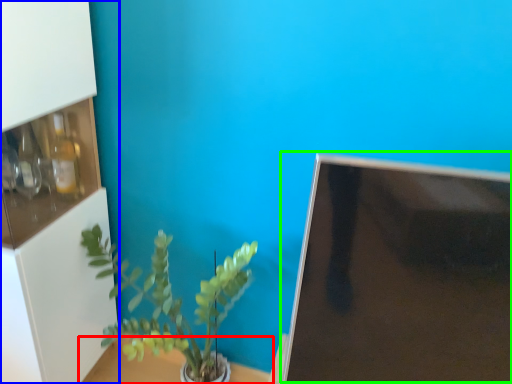
Question: Considering the real-world distances, which object is closest to table (highlighted by a red box)? shelf (highlighted by a blue box) or computer monitor (highlighted by a green box).

Choices:
 (A) shelf
 (B) computer monitor

Answer: (A)